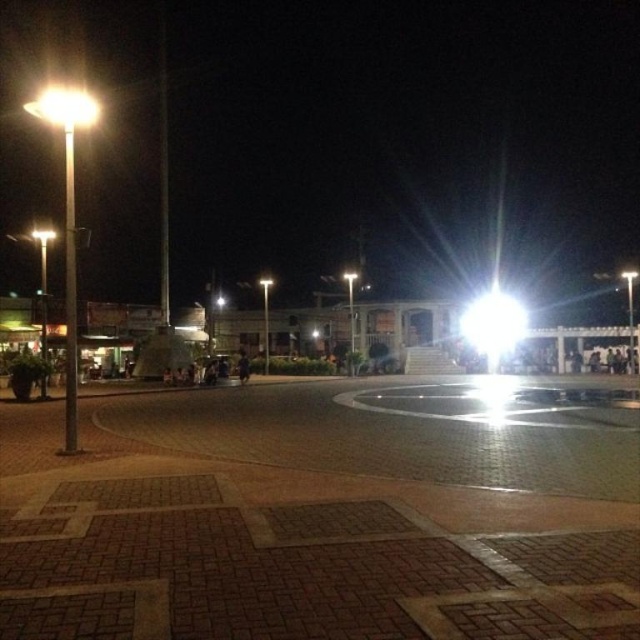
Question: Can you confirm if bright white light at center is bigger than matte white streetlight at upper left?

Choices:
 (A) no
 (B) yes

Answer: (A)

Question: Does bright white light at center have a greater width compared to matte white streetlight at upper left?

Choices:
 (A) no
 (B) yes

Answer: (A)

Question: Is bright white light at center bigger than matte white streetlight at upper left?

Choices:
 (A) yes
 (B) no

Answer: (B)